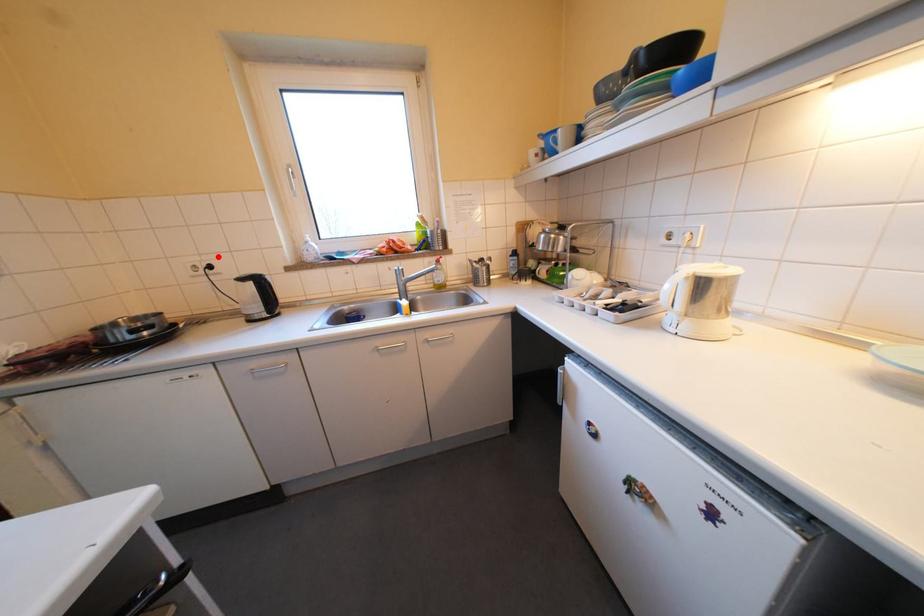
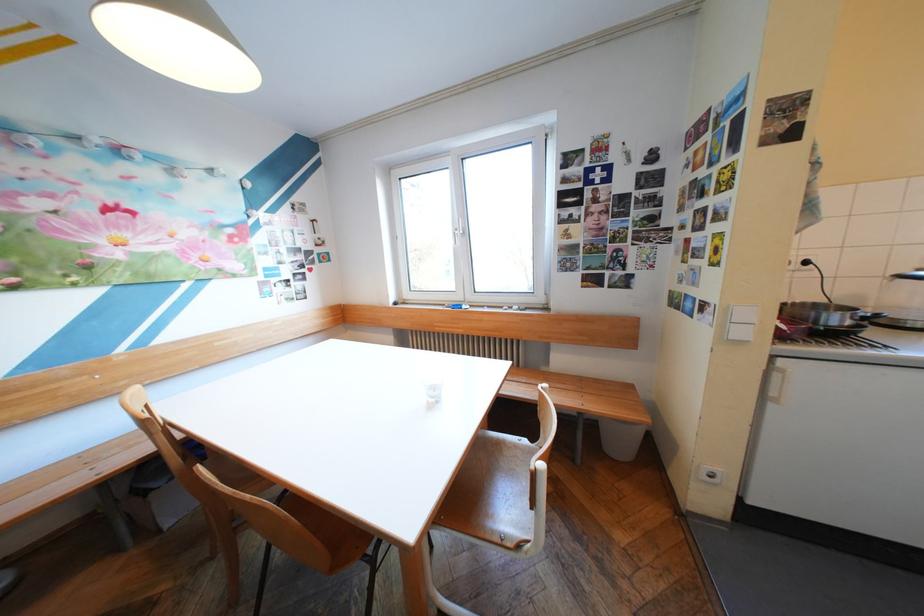
Question: I am providing you with two images of the same scene from different viewpoints. A red point is marked on the first image. Can you still see the location of the red point in image 2?

Choices:
 (A) Yes
 (B) No

Answer: (A)